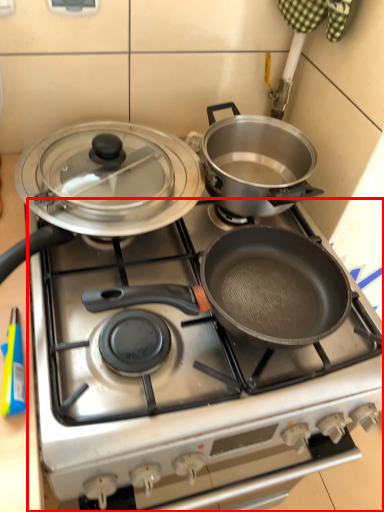
Question: From the image's perspective, considering the relative positions of gas stove (annotated by the red box) and kitchen appliance in the image provided, where is gas stove (annotated by the red box) located with respect to the staircase?

Choices:
 (A) below
 (B) above

Answer: (A)